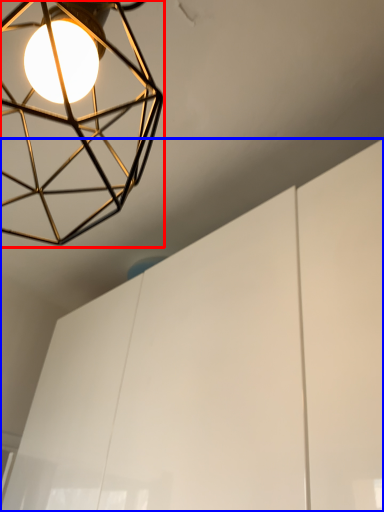
Question: Among these objects, which one is farthest to the camera, lamp (highlighted by a red box) or cabinetry (highlighted by a blue box)?

Choices:
 (A) lamp
 (B) cabinetry

Answer: (B)